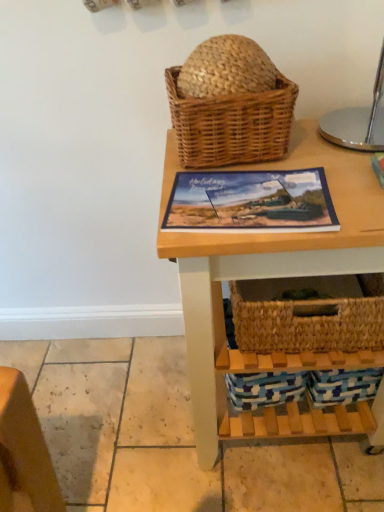
Question: Can you confirm if woven brown picnic basket at upper center is wider than natural wood table at center?

Choices:
 (A) yes
 (B) no

Answer: (B)

Question: Is woven brown picnic basket at upper center surrounding natural wood table at center?

Choices:
 (A) yes
 (B) no

Answer: (B)

Question: Is woven brown picnic basket at upper center looking in the opposite direction of natural wood table at center?

Choices:
 (A) no
 (B) yes

Answer: (A)

Question: Considering the relative positions of woven brown picnic basket at upper center and natural wood table at center in the image provided, is woven brown picnic basket at upper center in front of natural wood table at center?

Choices:
 (A) yes
 (B) no

Answer: (B)

Question: Is woven brown picnic basket at upper center thinner than natural wood table at center?

Choices:
 (A) no
 (B) yes

Answer: (B)

Question: Is woven brown picnic basket at upper center located outside natural wood table at center?

Choices:
 (A) yes
 (B) no

Answer: (A)

Question: From the image's perspective, is natural wood table at center below woven brown picnic basket at upper center?

Choices:
 (A) no
 (B) yes

Answer: (B)

Question: From a real-world perspective, is natural wood table at center over woven brown picnic basket at upper center?

Choices:
 (A) yes
 (B) no

Answer: (B)

Question: Is natural wood table at center oriented towards woven brown picnic basket at upper center?

Choices:
 (A) no
 (B) yes

Answer: (A)

Question: Is natural wood table at center smaller than woven brown picnic basket at upper center?

Choices:
 (A) no
 (B) yes

Answer: (A)

Question: Are natural wood table at center and woven brown picnic basket at upper center beside each other?

Choices:
 (A) yes
 (B) no

Answer: (B)

Question: Does natural wood table at center have a lesser width compared to woven brown picnic basket at upper center?

Choices:
 (A) yes
 (B) no

Answer: (B)

Question: Is matte plastic picture frame at center far from woven brown picnic basket at upper center?

Choices:
 (A) yes
 (B) no

Answer: (B)